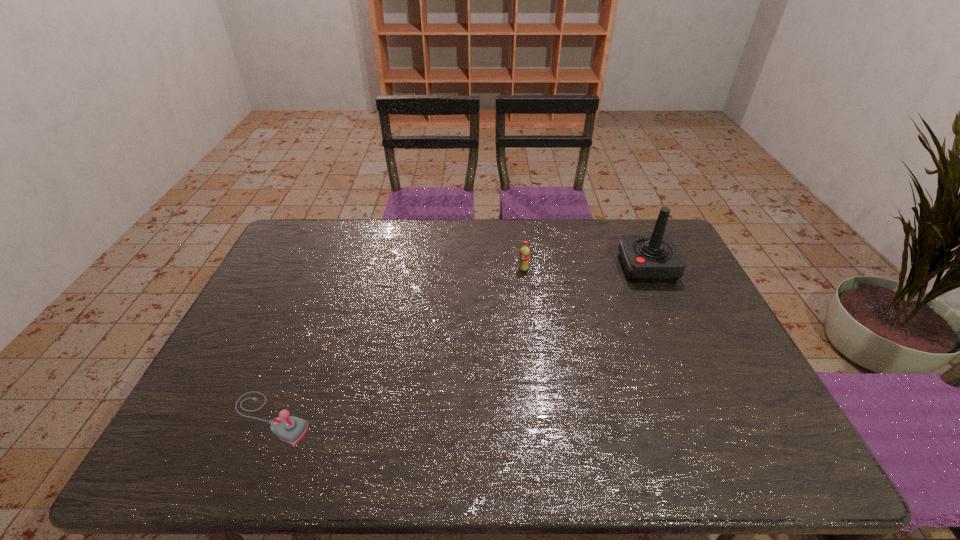
This screenshot has height=540, width=960. In the image, there is a desktop. Identify the location of vacant area at the right edge. (742, 403).

The height and width of the screenshot is (540, 960). In order to click on vacant space at the near left corner of the desktop in this screenshot , I will do `click(233, 469)`.

In the image, there is a desktop. Identify the location of vacant space at the far right corner. (624, 224).

Locate an element on the screen. free space between the soda and the shortest object is located at coordinates (397, 343).

Where is `free space that is in between the soda and the nearest object`? This screenshot has width=960, height=540. free space that is in between the soda and the nearest object is located at coordinates (397, 343).

The width and height of the screenshot is (960, 540). I want to click on vacant space that is in between the right joystick and the left joystick, so click(x=459, y=343).

Where is `vacant region between the shortest object and the soda`? vacant region between the shortest object and the soda is located at coordinates (397, 343).

Locate an element on the screen. This screenshot has width=960, height=540. free spot between the second shortest object and the tallest object is located at coordinates (586, 268).

Find the location of a particular element. Image resolution: width=960 pixels, height=540 pixels. free space between the taller joystick and the second tallest object is located at coordinates [x=586, y=268].

Identify the location of free space between the second tallest object and the rightmost object. The width and height of the screenshot is (960, 540). (586, 268).